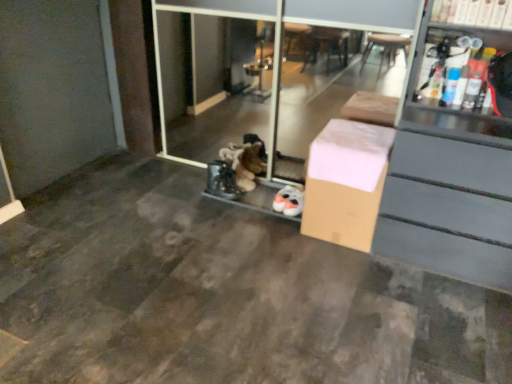
Question: Is white cardboard box at upper right wider or thinner than brown cardboard box at center?

Choices:
 (A) thin
 (B) wide

Answer: (A)

Question: In the image, is white cardboard box at upper right positioned in front of or behind brown cardboard box at center?

Choices:
 (A) behind
 (B) front

Answer: (B)

Question: Which object is the farthest from the brown cardboard box at center?

Choices:
 (A) transparent glass screen door at center
 (B) white cardboard box at upper right

Answer: (A)

Question: Which object is positioned closest to the white cardboard box at upper right?

Choices:
 (A) brown cardboard box at center
 (B) transparent glass screen door at center

Answer: (A)